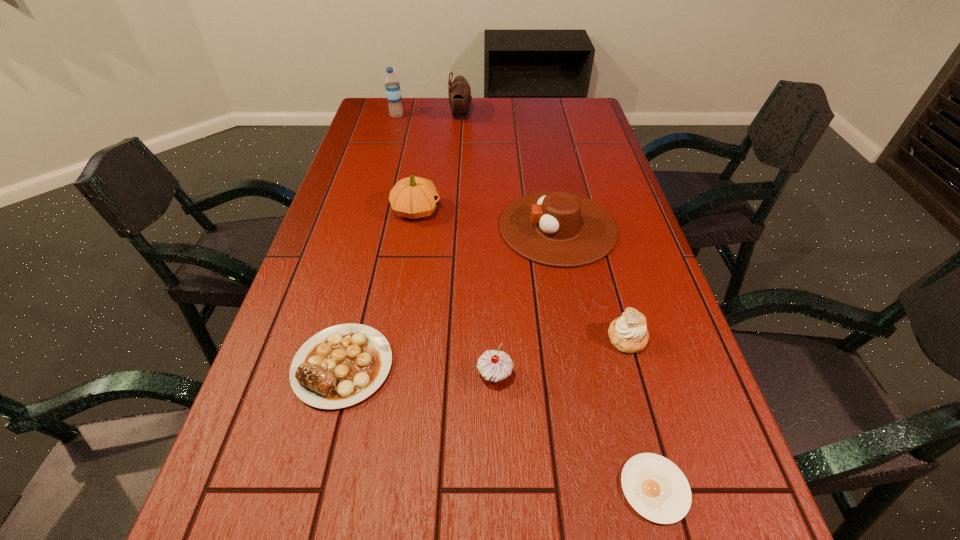
Find the location of a particular element. The width and height of the screenshot is (960, 540). the tallest object is located at coordinates (392, 87).

I want to click on pouch, so click(459, 92).

This screenshot has width=960, height=540. I want to click on gourd, so click(413, 197).

I want to click on cupcake, so click(494, 366).

At what (x,y) coordinates should I click in order to perform the action: click on cowboy hat. Please return your answer as a coordinate pair (x, y). The height and width of the screenshot is (540, 960). Looking at the image, I should click on (555, 228).

Locate an element on the screen. pastry is located at coordinates (628, 333).

At what (x,y) coordinates should I click in order to perform the action: click on the seventh tallest object. Please return your answer as a coordinate pair (x, y). The image size is (960, 540). Looking at the image, I should click on (340, 366).

Locate an element on the screen. The width and height of the screenshot is (960, 540). the nearest object is located at coordinates (655, 487).

This screenshot has width=960, height=540. Identify the location of egg yolk. 655,487.

Where is `vacant area situated on the label of the water bottle`? The height and width of the screenshot is (540, 960). vacant area situated on the label of the water bottle is located at coordinates (441, 116).